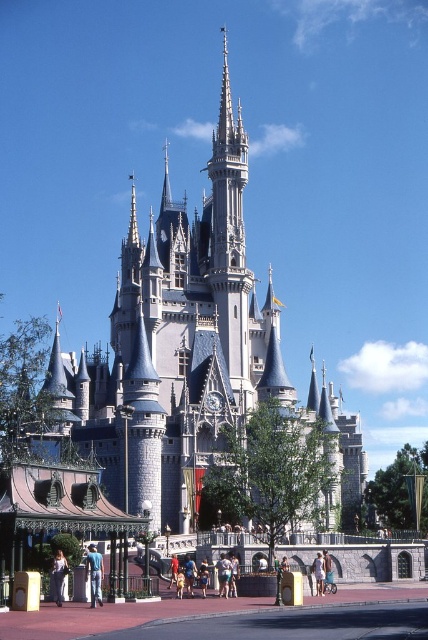
Does denim jeans at lower left lie in front of light blue denim shorts at center?

That is True.

Which is below, denim jeans at lower left or light blue denim shorts at center?

light blue denim shorts at center

Does point (101, 566) come closer to viewer compared to point (225, 579)?

Yes, point (101, 566) is closer to viewer.

At what (x,y) coordinates should I click in order to perform the action: click on denim jeans at lower left. Please return your answer as a coordinate pair (x, y). The image size is (428, 640). Looking at the image, I should click on (95, 573).

Which is below, light brown fabric dress at lower left or light brown leather shoes at center?

Positioned lower is light brown leather shoes at center.

Which of these two, light brown fabric dress at lower left or light brown leather shoes at center, stands taller?

Standing taller between the two is light brown fabric dress at lower left.

Does point (62, 577) come farther from viewer compared to point (184, 576)?

That is False.

The image size is (428, 640). I want to click on light brown fabric dress at lower left, so click(59, 576).

Can you confirm if light blue denim shorts at center is positioned above light brown shorts at center?

No.

Is light blue denim shorts at center shorter than light brown shorts at center?

Yes, light blue denim shorts at center is shorter than light brown shorts at center.

Between point (220, 580) and point (324, 561), which one is positioned behind?

Positioned behind is point (324, 561).

I want to click on light blue denim shorts at center, so click(223, 573).